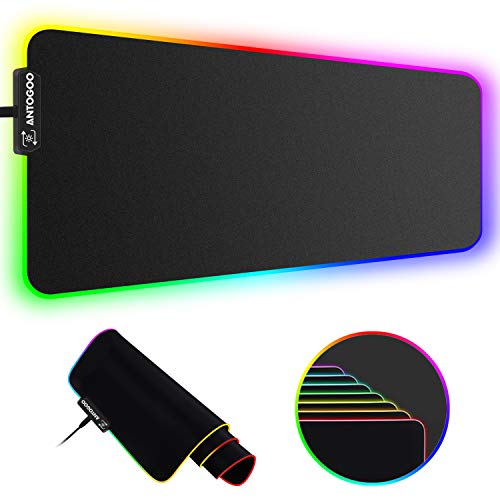
Locate an element on the screen. This screenshot has width=500, height=500. mat rolled up is located at coordinates (158, 414).